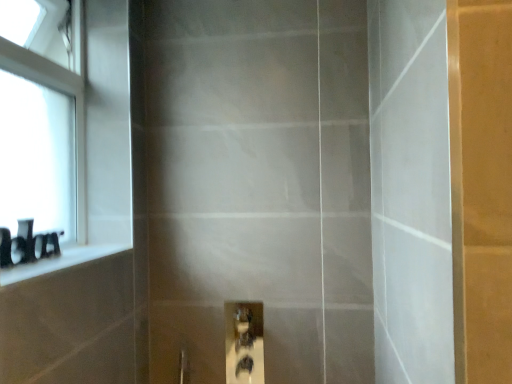
Question: Is black glossy ledge at left at the left side of black matte toiletries at left?

Choices:
 (A) no
 (B) yes

Answer: (A)

Question: Does black glossy ledge at left have a greater height compared to black matte toiletries at left?

Choices:
 (A) yes
 (B) no

Answer: (B)

Question: Is there a large distance between black glossy ledge at left and black matte toiletries at left?

Choices:
 (A) no
 (B) yes

Answer: (A)

Question: Is black glossy ledge at left further to camera compared to black matte toiletries at left?

Choices:
 (A) no
 (B) yes

Answer: (A)

Question: From the image's perspective, is black glossy ledge at left on top of black matte toiletries at left?

Choices:
 (A) yes
 (B) no

Answer: (B)

Question: From a real-world perspective, is matte glass screen door at center above or below black matte toiletries at left?

Choices:
 (A) above
 (B) below

Answer: (A)

Question: Is point (330, 92) closer or farther from the camera than point (51, 248)?

Choices:
 (A) farther
 (B) closer

Answer: (A)

Question: Looking at the image, does matte glass screen door at center seem bigger or smaller compared to black matte toiletries at left?

Choices:
 (A) big
 (B) small

Answer: (A)

Question: Which is correct: matte glass screen door at center is inside black matte toiletries at left, or outside of it?

Choices:
 (A) inside
 (B) outside

Answer: (B)

Question: Relative to white glass window at upper left, is matte glass screen door at center in front or behind?

Choices:
 (A) front
 (B) behind

Answer: (A)

Question: Looking at their shapes, would you say matte glass screen door at center is wider or thinner than white glass window at upper left?

Choices:
 (A) thin
 (B) wide

Answer: (B)

Question: From the image's perspective, is matte glass screen door at center above or below white glass window at upper left?

Choices:
 (A) below
 (B) above

Answer: (A)

Question: Is matte glass screen door at center taller or shorter than white glass window at upper left?

Choices:
 (A) short
 (B) tall

Answer: (B)

Question: Is black matte toiletries at left situated inside matte glass screen door at center or outside?

Choices:
 (A) inside
 (B) outside

Answer: (B)

Question: Would you say black matte toiletries at left is to the left or to the right of matte glass screen door at center in the picture?

Choices:
 (A) right
 (B) left

Answer: (B)